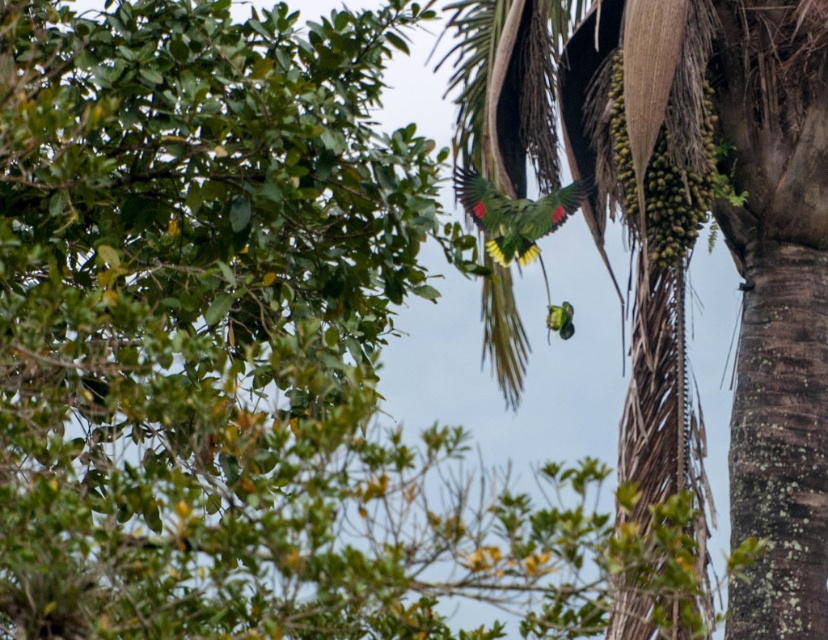
Between green leafy coconut tree at upper right and green matte parrot at center, which one is positioned lower?

green leafy coconut tree at upper right

Is green leafy coconut tree at upper right smaller than green matte parrot at center?

No, green leafy coconut tree at upper right is not smaller than green matte parrot at center.

Does point (733, 42) come closer to viewer compared to point (506, 204)?

Yes, point (733, 42) is closer to viewer.

Identify the location of green leafy coconut tree at upper right. The image size is (828, 640). (739, 272).